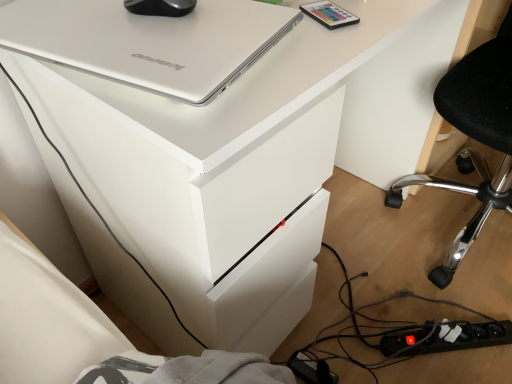
Locate an element on the screen. vacant area in front of black rubberized mouse at upper center is located at coordinates (150, 41).